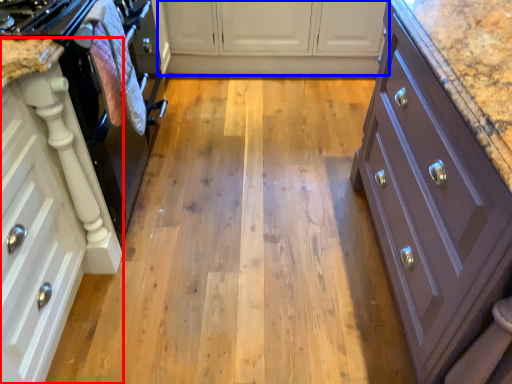
Question: Among these objects, which one is farthest to the camera, cabinetry (highlighted by a red box) or cabinetry (highlighted by a blue box)?

Choices:
 (A) cabinetry
 (B) cabinetry

Answer: (B)